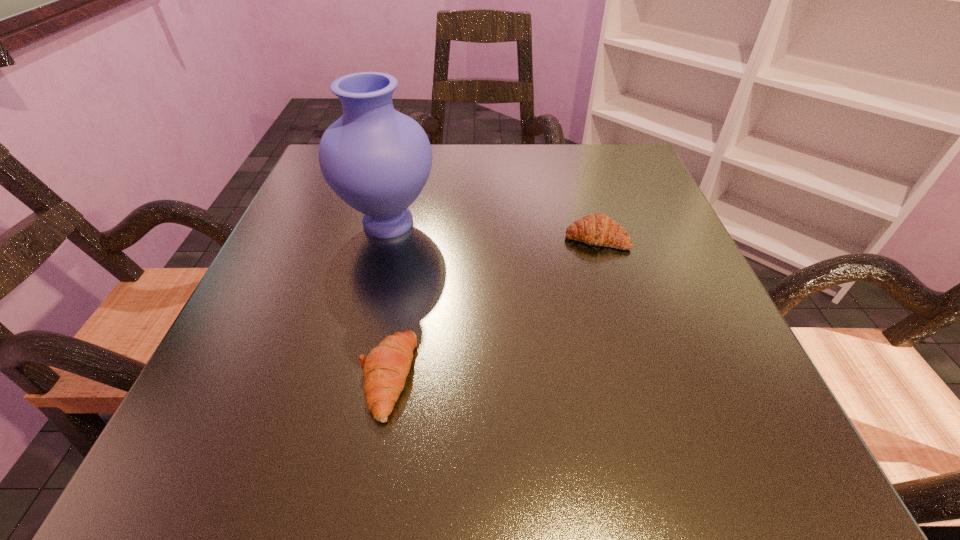
Locate an element on the screen. This screenshot has height=540, width=960. object positioned at the left edge is located at coordinates (377, 160).

Identify the location of object present at the right edge. The height and width of the screenshot is (540, 960). (598, 229).

Locate an element on the screen. object located at the far left corner is located at coordinates (377, 160).

Image resolution: width=960 pixels, height=540 pixels. In order to click on free spot at the far edge of the desktop in this screenshot , I will do `click(540, 151)`.

Find the location of `blank area at the near edge`. blank area at the near edge is located at coordinates (555, 484).

In the image, there is a desktop. Where is `vacant area at the left edge`? This screenshot has height=540, width=960. vacant area at the left edge is located at coordinates (282, 256).

You are a GUI agent. You are given a task and a screenshot of the screen. Output one action in this format:
    pyautogui.click(x=<x>, y=<y>)
    Task: Click on the vacant space at the right edge of the desktop
    The width and height of the screenshot is (960, 540).
    Given the screenshot: What is the action you would take?
    pyautogui.click(x=740, y=353)

Locate an element on the screen. The image size is (960, 540). vacant space at the far left corner of the desktop is located at coordinates (319, 178).

Find the location of a particular element. Image resolution: width=960 pixels, height=540 pixels. vacant area at the near left corner of the desktop is located at coordinates (177, 449).

I want to click on vacant space at the far right corner of the desktop, so click(603, 152).